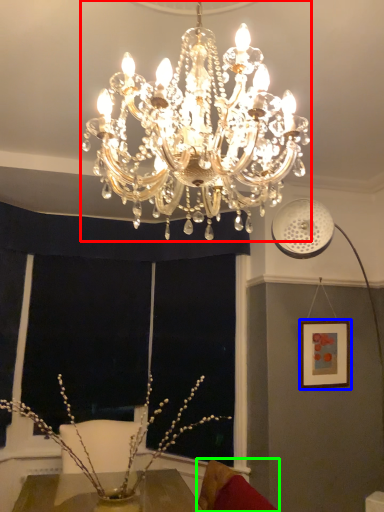
Question: Which is nearer to the lamp (highlighted by a red box)? picture frame (highlighted by a blue box) or swivel chair (highlighted by a green box).

Choices:
 (A) picture frame
 (B) swivel chair

Answer: (B)